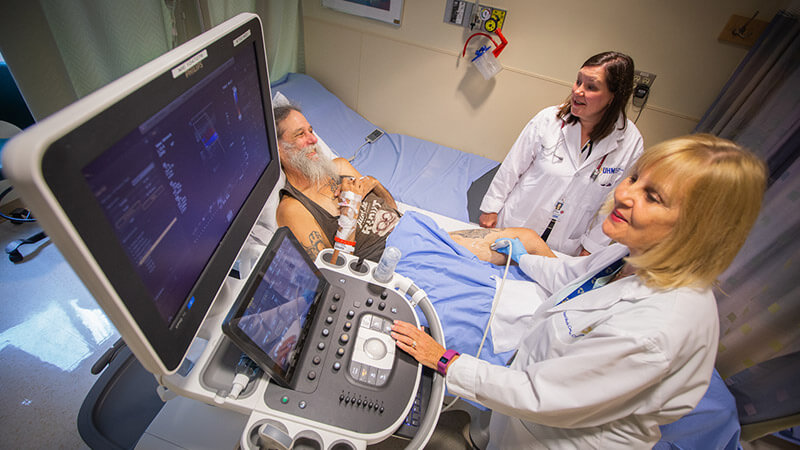
Image resolution: width=800 pixels, height=450 pixels. Identify the location of dividers. (136, 39), (274, 29), (766, 120), (777, 289).